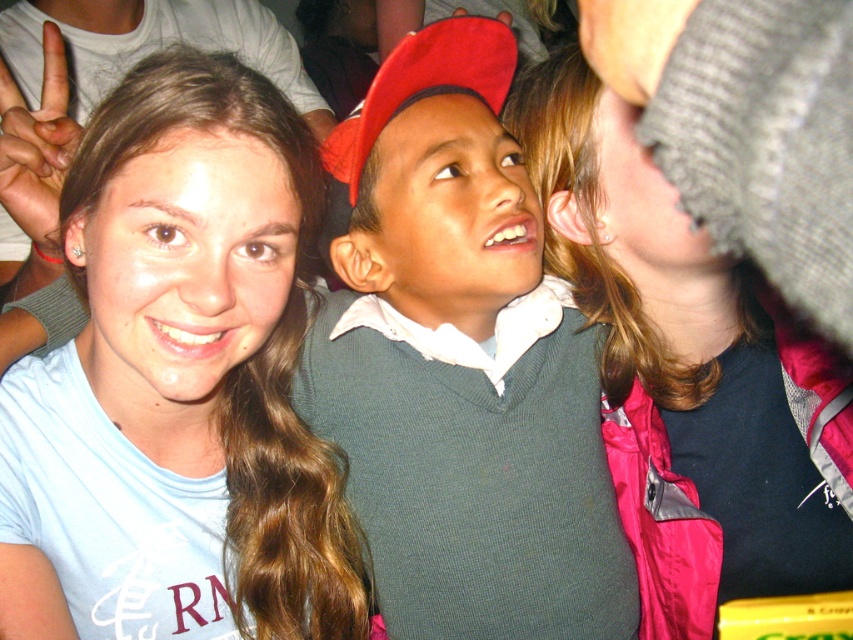
You are a photographer trying to capture a closeup of the light blue cotton shirt at center and the knitted gray hat at upper right in the scene. Given that your camera lens has a maximum focus range of 12 inches, will you be able to focus on both objects simultaneously?

The light blue cotton shirt at center and knitted gray hat at upper right are 12.90 inches apart from each other. Since the distance between them exceeds the camera lens maximum focus range of 12 inches, you cannot focus on both objects simultaneously.

You are standing in the scene and see the point at coordinates (178,384). Which object is this point located on?

The point at coordinates (178,384) is located on the light blue cotton shirt at center.

You are a photographer trying to capture the boy in the center wearing the green knitted sweater at center and the knitted gray hat at upper right. If you want to frame both objects in the same shot without moving the camera, which object should you ensure is closer to the left side of the frame?

The green knitted sweater at center is to the left of the knitted gray hat at upper right, so you should ensure the green knitted sweater at center is closer to the left side of the frame to include both in the shot.